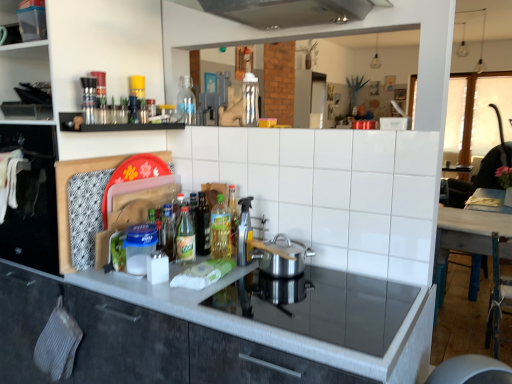
What do you see at coordinates (22, 22) in the screenshot? I see `transparent plastic container at upper left, the second shelf from the bottom` at bounding box center [22, 22].

What is the approximate width of transparent plastic container at upper left, the 2th shelf viewed from the right?

It is 7.46 inches.

Identify the location of translucent plastic bottle at center, the 3th bottle when ordered from top to bottom. The height and width of the screenshot is (384, 512). (220, 230).

What is the approximate width of translucent plastic bottle at center, the fourth bottle in the left-to-right sequence?

3.20 inches.

In order to face matte gray cabinetry at center, should I rotate leftwards or rightwards?

Turn left by 2.359 degrees to look at matte gray cabinetry at center.

The width and height of the screenshot is (512, 384). What are the coordinates of `transparent plastic container at upper left, the 1th shelf when ordered from top to bottom` in the screenshot? It's located at (22, 22).

Would you say white glossy tile at center is outside translucent glass bottle at center, which ranks as the fourth bottle in right-to-left order?

white glossy tile at center is positioned outside translucent glass bottle at center, which ranks as the fourth bottle in right-to-left order.

Considering the positions of objects white glossy tile at center and translucent glass bottle at center, the third bottle positioned from the front, in the image provided, who is more to the right, white glossy tile at center or translucent glass bottle at center, the third bottle positioned from the front,?

Positioned to the right is white glossy tile at center.

How much distance is there between white glossy tile at center and translucent glass bottle at center, the 1th bottle positioned from the left?

23.86 inches.

From a real-world perspective, is white glossy tile at center positioned over translucent glass bottle at center, acting as the 2th bottle starting from the back, based on gravity?

Yes, from a real-world perspective, white glossy tile at center is over translucent glass bottle at center, acting as the 2th bottle starting from the back

Are translucent plastic bottle at center, the fourth bottle in the left-to-right sequence, and translucent glass bottle at center, acting as the 2th bottle starting from the back, located far from each other?

No.

Is the position of translucent plastic bottle at center, which is the 2th bottle in front-to-back order, less distant than that of translucent glass bottle at center, the 1th bottle positioned from the left?

Yes.

Is translucent plastic bottle at center, placed as the third bottle when sorted from back to front, facing towards translucent glass bottle at center, which ranks as the fourth bottle in right-to-left order?

No, translucent plastic bottle at center, placed as the third bottle when sorted from back to front, is not facing towards translucent glass bottle at center, which ranks as the fourth bottle in right-to-left order.

From the image's perspective, which one is positioned higher, translucent plastic bottle at center, the 3th bottle when ordered from top to bottom, or black matte shelf at upper left, which is counted as the first shelf, starting from the right?

From the image's view, black matte shelf at upper left, which is counted as the first shelf, starting from the right, is above.

From a real-world perspective, which is physically below, translucent plastic bottle at center, the 3th bottle when ordered from top to bottom, or black matte shelf at upper left, which is counted as the 1th shelf, starting from the bottom?

In real-world perspective, translucent plastic bottle at center, the 3th bottle when ordered from top to bottom, is lower.

Does point (224, 230) lie behind point (124, 127)?

Yes.

Between translucent plastic bottle at center, placed as the third bottle when sorted from back to front, and black matte shelf at upper left, which is counted as the 1th shelf, starting from the bottom, which one has larger size?

black matte shelf at upper left, which is counted as the 1th shelf, starting from the bottom, is bigger.

Is wooden table at right at the back of white glossy tile at center?

Yes, wooden table at right is at the back of white glossy tile at center.

From a real-world perspective, does white glossy tile at center stand above wooden table at right?

Yes, from a real-world perspective, white glossy tile at center is above wooden table at right.

Is white glossy tile at center positioned before wooden table at right?

Yes, it is.

In the scene shown: How many degrees apart are the facing directions of white glossy tile at center and wooden table at right?

There is a 90.5-degree angle between the facing directions of white glossy tile at center and wooden table at right.

From the image's perspective, is clear glass bottle at center, which is the fourth bottle from bottom to top, above or below translucent plastic bottle at center, the first bottle in the bottom-to-top sequence?

clear glass bottle at center, which is the fourth bottle from bottom to top, is above translucent plastic bottle at center, the first bottle in the bottom-to-top sequence.

Would you say clear glass bottle at center, which ranks as the 4th bottle in front-to-back order, is inside or outside translucent plastic bottle at center, the 4th bottle when ordered from back to front?

clear glass bottle at center, which ranks as the 4th bottle in front-to-back order, is spatially situated outside translucent plastic bottle at center, the 4th bottle when ordered from back to front.

Can you see clear glass bottle at center, placed as the first bottle when sorted from back to front, touching translucent plastic bottle at center, which is counted as the 1th bottle, starting from the front?

They are not placed beside each other.

Does clear glass bottle at center, arranged as the first bottle when viewed from the top, have a lesser width compared to translucent plastic bottle at center, which is counted as the 1th bottle, starting from the front?

Indeed, clear glass bottle at center, arranged as the first bottle when viewed from the top, has a lesser width compared to translucent plastic bottle at center, which is counted as the 1th bottle, starting from the front.

Considering the positions of point (165, 246) and point (4, 23), is point (165, 246) closer or farther from the camera than point (4, 23)?

Clearly, point (165, 246) is closer to the camera than point (4, 23).

Is translucent glass bottle at center, the second bottle when ordered from top to bottom, facing towards transparent plastic container at upper left, which is the first shelf in left-to-right order?

No, translucent glass bottle at center, the second bottle when ordered from top to bottom, is not aimed at transparent plastic container at upper left, which is the first shelf in left-to-right order.

Is translucent glass bottle at center, which ranks as the fourth bottle in right-to-left order, not close to transparent plastic container at upper left, the 1th shelf when ordered from top to bottom?

Actually, translucent glass bottle at center, which ranks as the fourth bottle in right-to-left order, and transparent plastic container at upper left, the 1th shelf when ordered from top to bottom, are a little close together.

I want to click on bottle above the black matte shelf at upper left, the second shelf when ordered from top to bottom (from the image's perspective), so click(186, 101).

Would you say clear glass bottle at center, placed as the first bottle when sorted from back to front, is a long distance from black matte shelf at upper left, positioned as the second shelf in left-to-right order?

No, clear glass bottle at center, placed as the first bottle when sorted from back to front, is not far away from black matte shelf at upper left, positioned as the second shelf in left-to-right order.

What's the angular difference between clear glass bottle at center, which ranks as the 4th bottle in front-to-back order, and black matte shelf at upper left, the second shelf when ordered from top to bottom,'s facing directions?

clear glass bottle at center, which ranks as the 4th bottle in front-to-back order, and black matte shelf at upper left, the second shelf when ordered from top to bottom, are facing 88.2 degrees away from each other.

Could you tell me if clear glass bottle at center, which ranks as the 4th bottle in front-to-back order, is turned towards black matte shelf at upper left, which is counted as the 1th shelf, starting from the bottom?

Yes, clear glass bottle at center, which ranks as the 4th bottle in front-to-back order, is aimed at black matte shelf at upper left, which is counted as the 1th shelf, starting from the bottom.

Locate an element on the screen. This screenshot has width=512, height=384. the 3rd bottle behind the white glossy tile at center, starting your count from the anchor is located at coordinates [167, 232].

Where is `the 1st bottle in front of the translucent glass bottle at center, the second bottle when ordered from top to bottom, counting from the anchor's position`? the 1st bottle in front of the translucent glass bottle at center, the second bottle when ordered from top to bottom, counting from the anchor's position is located at coordinates (220, 230).

Which object lies further to the anchor point translucent plastic bottle at center, the first bottle in the bottom-to-top sequence, clear plastic spray bottle at center or wooden table at right?

The object further to translucent plastic bottle at center, the first bottle in the bottom-to-top sequence, is wooden table at right.

Looking at the image, which one is located further to transparent plastic container at upper left, the 2th shelf viewed from the right, clear glass bottle at center, the third bottle positioned from the right, or wooden table at right?

Among the two, wooden table at right is located further to transparent plastic container at upper left, the 2th shelf viewed from the right.

Which object lies further to the anchor point polished stainless steel pot at center, matte gray cabinetry at center or translucent glass bottle at center, which is the 3th bottle in bottom-to-top order?

matte gray cabinetry at center is further to polished stainless steel pot at center.

Based on their spatial positions, is white glossy tile at center or black matte shelf at upper left, which is counted as the first shelf, starting from the right, closer to translucent glass bottle at center, the 1th bottle positioned from the left?

Based on the image, black matte shelf at upper left, which is counted as the first shelf, starting from the right, appears to be nearer to translucent glass bottle at center, the 1th bottle positioned from the left.

When comparing their distances from wooden table at right, does clear plastic spray bottle at center or black matte shelf at upper left, which is counted as the first shelf, starting from the right, seem closer?

clear plastic spray bottle at center lies closer to wooden table at right than the other object.

Looking at the image, which one is located closer to clear glass bottle at center, the 2th bottle viewed from the left, matte gray cabinetry at center or polished stainless steel pot at center?

polished stainless steel pot at center is closer to clear glass bottle at center, the 2th bottle viewed from the left.

From the image, which object appears to be farther from matte gray cabinetry at center, translucent plastic bottle at center, which is the 2th bottle in front-to-back order, or black matte shelf at upper left, positioned as the second shelf in left-to-right order?

black matte shelf at upper left, positioned as the second shelf in left-to-right order, is further to matte gray cabinetry at center.

Looking at the image, which one is located closer to black matte shelf at upper left, which is counted as the first shelf, starting from the right, translucent glass bottle at center, which ranks as the fourth bottle in right-to-left order, or wooden table at right?

translucent glass bottle at center, which ranks as the fourth bottle in right-to-left order.

Find the location of a particular element. kitchen appliance located between translucent plastic bottle at center, the second bottle from the right, and wooden table at right in the left-right direction is located at coordinates (283, 257).

Identify the location of appliance between clear glass bottle at center, the third bottle positioned from the right, and translucent glass bottle at center, the 1th bottle positioned from the left, from top to bottom. (244, 233).

This screenshot has height=384, width=512. I want to click on appliance between clear glass bottle at center, the 2th bottle viewed from the left, and polished stainless steel pot at center in the up-down direction, so click(x=244, y=233).

Where is `appliance between transparent plastic container at upper left, the second shelf from the bottom, and translucent plastic bottle at center, the 3th bottle when ordered from top to bottom, from top to bottom`? This screenshot has width=512, height=384. appliance between transparent plastic container at upper left, the second shelf from the bottom, and translucent plastic bottle at center, the 3th bottle when ordered from top to bottom, from top to bottom is located at coordinates (244, 233).